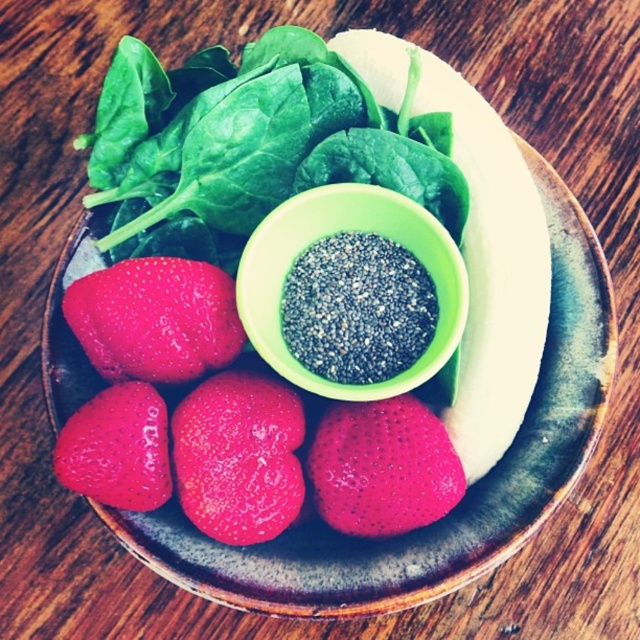
Question: Which object is the farthest from the black granular powder at center?

Choices:
 (A) glossy red strawberry at lower left
 (B) green leafy vegetable at upper center

Answer: (A)

Question: Is green leafy vegetable at upper center thinner than green matte bowl at center?

Choices:
 (A) no
 (B) yes

Answer: (A)

Question: Which point appears closest to the camera in this image?

Choices:
 (A) [269, 244]
 (B) [113, 216]
 (C) [282, 470]
 (D) [348, 416]

Answer: (C)

Question: Which object is farther from the camera taking this photo?

Choices:
 (A) green matte bowl at center
 (B) smooth red strawberry at center

Answer: (B)

Question: Is glossy red strawberry at center to the left of glossy red strawberry at lower left from the viewer's perspective?

Choices:
 (A) no
 (B) yes

Answer: (A)

Question: From the image, what is the correct spatial relationship of green matte bowl at center in relation to black granular powder at center?

Choices:
 (A) above
 (B) below

Answer: (A)